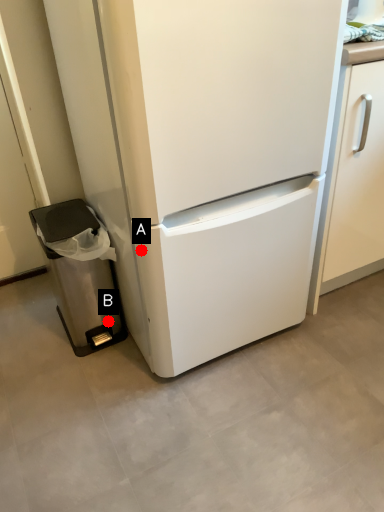
Question: Two points are circled on the image, labeled by A and B beside each circle. Among these points, which one is nearest to the camera?

Choices:
 (A) A is closer
 (B) B is closer

Answer: (A)